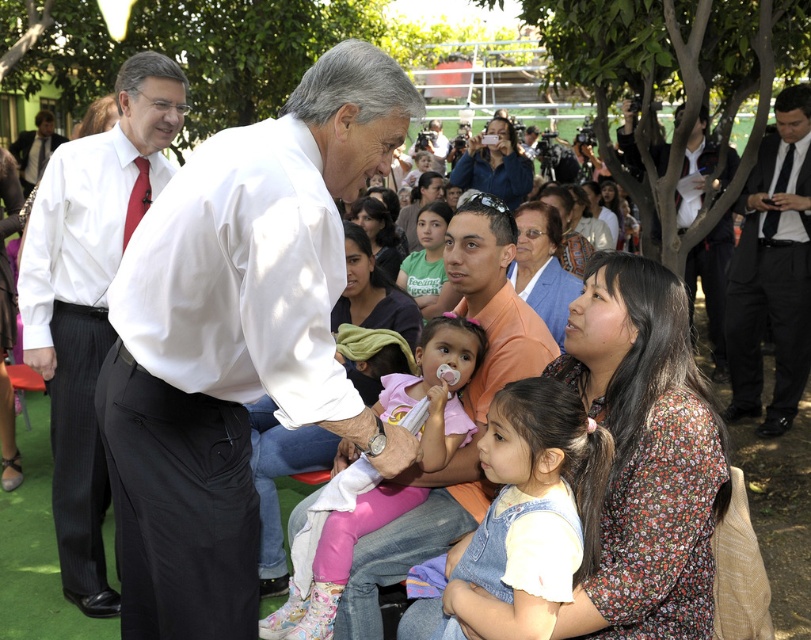
Question: Based on their relative distances, which object is farther from the denim overalls at center?

Choices:
 (A) pink fabric at center
 (B) red silk tie at center
 (C) black suit at right
 (D) white shirt at left

Answer: (C)

Question: In this image, where is pink fabric at center located relative to red silk tie at center?

Choices:
 (A) above
 (B) below

Answer: (B)

Question: Which point is farther from the camera taking this photo?

Choices:
 (A) (217, 556)
 (B) (178, 80)
 (C) (779, 198)
 (D) (127, 236)

Answer: (C)

Question: Is black suit at right smaller than red silk tie at center?

Choices:
 (A) no
 (B) yes

Answer: (A)

Question: Does pink fabric at center have a larger size compared to red silk tie at center?

Choices:
 (A) no
 (B) yes

Answer: (B)

Question: Which is nearer to the denim overalls at center?

Choices:
 (A) white shirt at left
 (B) black suit at right
 (C) pink fabric at center

Answer: (C)